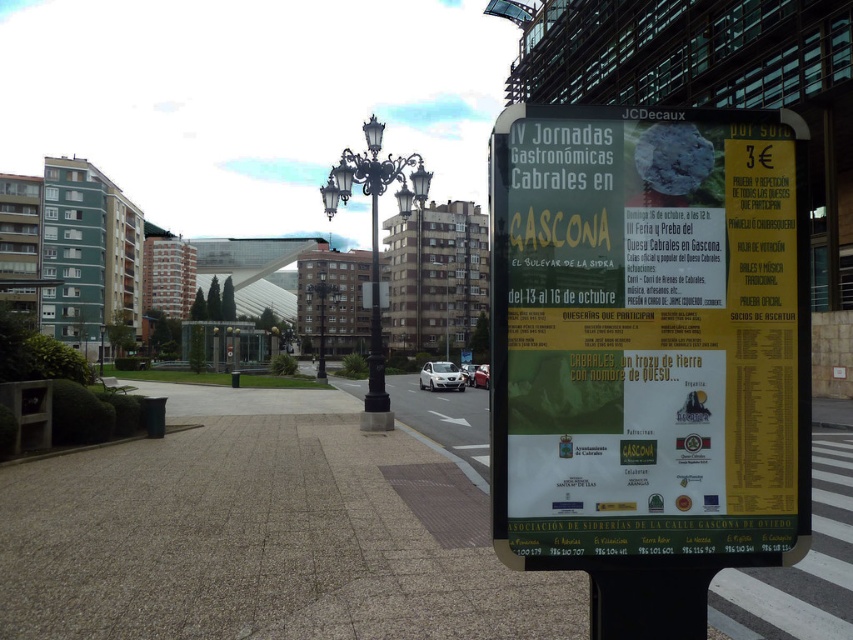
Question: Among these objects, which one is farthest from the camera?

Choices:
 (A) gray concrete pavement at center
 (B) metallic street sign at center
 (C) white paper poster at right

Answer: (B)

Question: Estimate the real-world distances between objects in this image. Which object is closer to the metallic street sign at center?

Choices:
 (A) gray concrete pavement at center
 (B) white paper poster at right

Answer: (A)

Question: Does white paper poster at right appear on the right side of metallic street sign at center?

Choices:
 (A) no
 (B) yes

Answer: (B)

Question: Is gray concrete pavement at center wider than metallic street sign at center?

Choices:
 (A) no
 (B) yes

Answer: (A)

Question: Which of the following is the farthest from the observer?

Choices:
 (A) pyautogui.click(x=566, y=600)
 (B) pyautogui.click(x=322, y=330)
 (C) pyautogui.click(x=636, y=115)

Answer: (B)

Question: Can you confirm if white paper poster at right is thinner than metallic street sign at center?

Choices:
 (A) yes
 (B) no

Answer: (A)